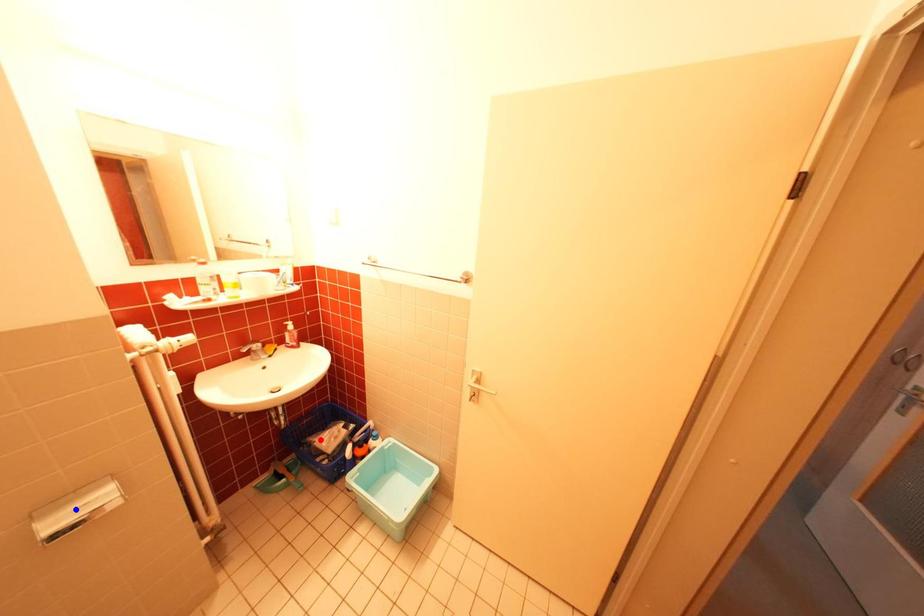
Question: Two points are marked on the image. Which point is closer to the camera?

Choices:
 (A) Blue point is closer.
 (B) Red point is closer.

Answer: (A)